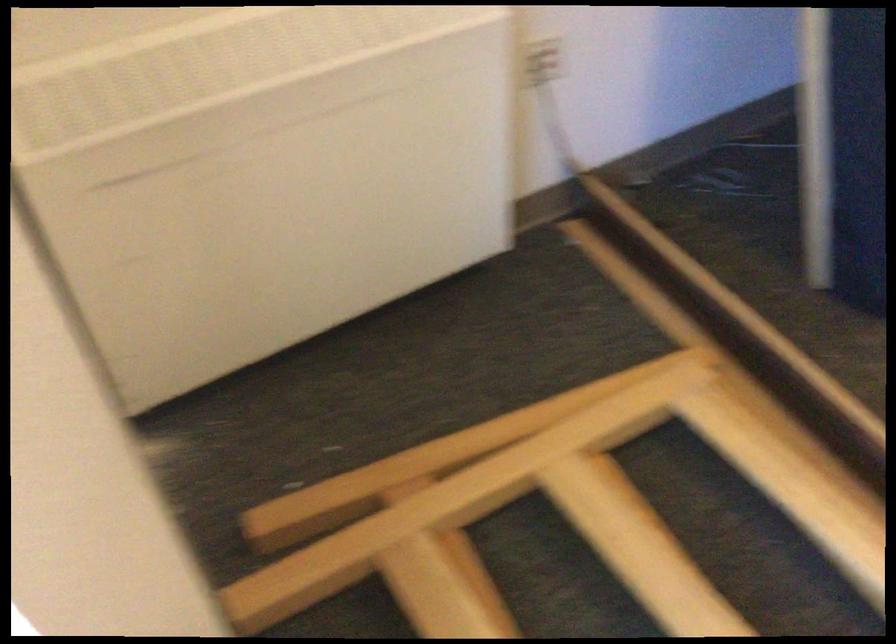
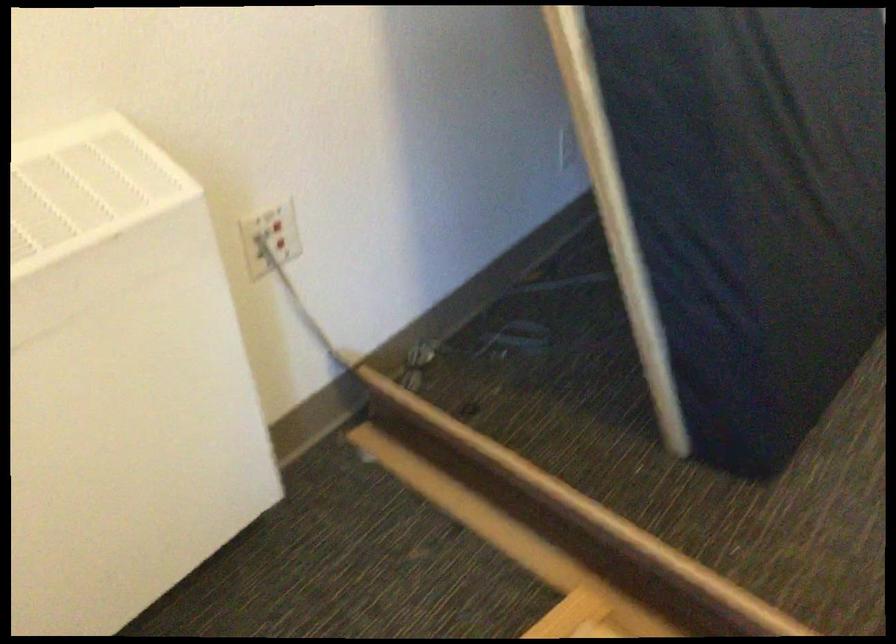
Question: The camera is either moving clockwise (left) or counter-clockwise (right) around the object. The first image is from the beginning of the video and the second image is from the end. Is the camera moving left or right when shooting the video?

Choices:
 (A) Left
 (B) Right

Answer: (A)